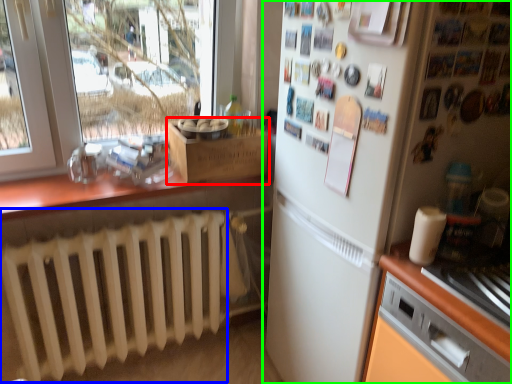
Question: Based on their relative distances, which object is farther from cardboard box (highlighted by a red box)? Choose from radiator (highlighted by a blue box) and refrigerator (highlighted by a green box).

Choices:
 (A) radiator
 (B) refrigerator

Answer: (B)